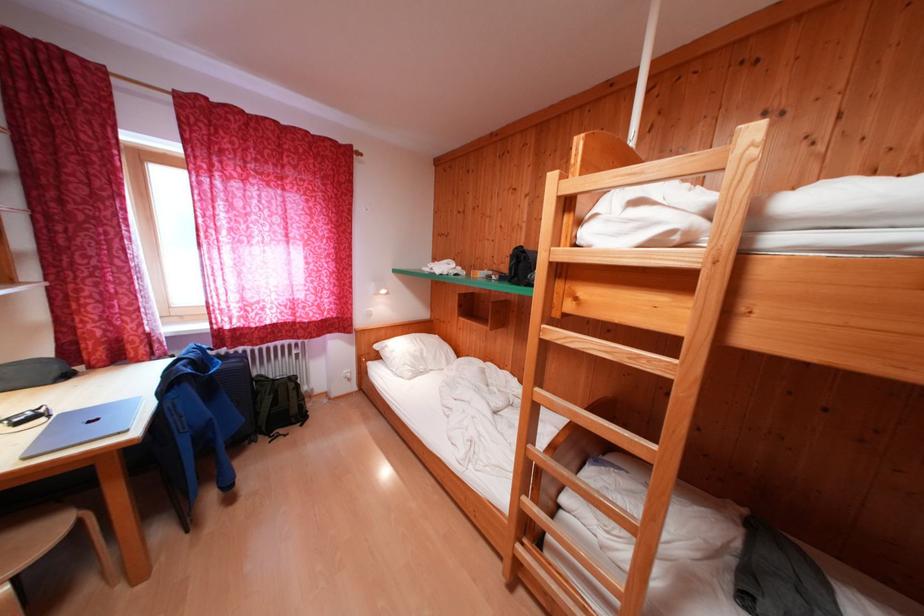
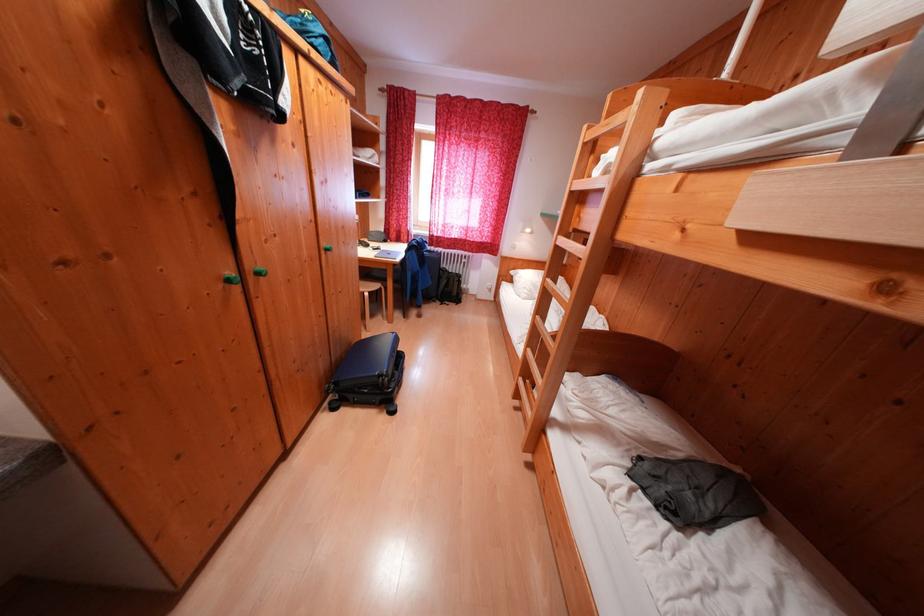
The point at (532, 503) is marked in the first image. Where is the corresponding point in the second image?

(537, 354)